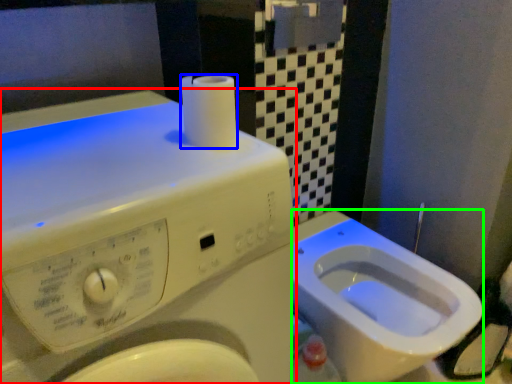
Question: Which object is the closest to the washing machine (highlighted by a red box)? Choose among these: toilet paper (highlighted by a blue box) or bidet (highlighted by a green box).

Choices:
 (A) toilet paper
 (B) bidet

Answer: (A)